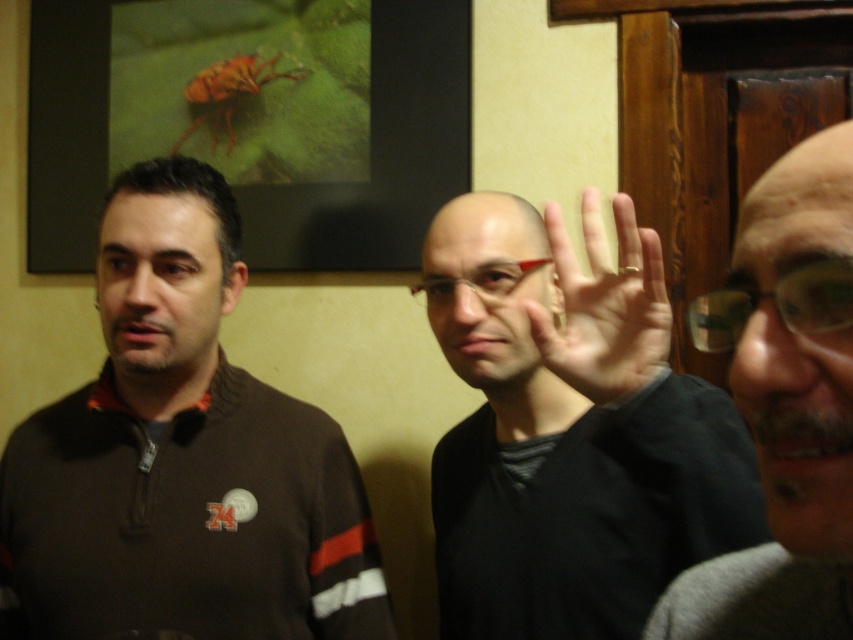
You are planning to hang a small painting that is 10 inches wide on the wall where the matte black frame at upper center and glossy skin at upper right are located. Based on their sizes, which object would provide more space for the painting to be placed next to it without overlapping?

The matte black frame at upper center has a larger size compared to glossy skin at upper right, so placing the painting next to the matte black frame at upper center would provide more space without overlapping.

You are designing a display case for small items. The display case has a shelf that can only hold items up to the size of the transparent plastic glasses at center. Can the matte black frame at upper center fit on this shelf?

The matte black frame at upper center has a larger size compared to transparent plastic glasses at center, so it cannot fit on the shelf designed for items up to the size of the transparent plastic glasses at center.

You are an interior designer assessing a wall in a client room. The wall has a matte black frame at upper center and transparent plastic glasses at center. The client wants to know if the glasses can fit horizontally next to the frame without overlapping. Based on their widths, can they?

The matte black frame at upper center is wider than the transparent plastic glasses at center. Since the frame is wider, there would be sufficient space to place the glasses next to it without overlapping, provided the total width of both items together does not exceed the wall space available.